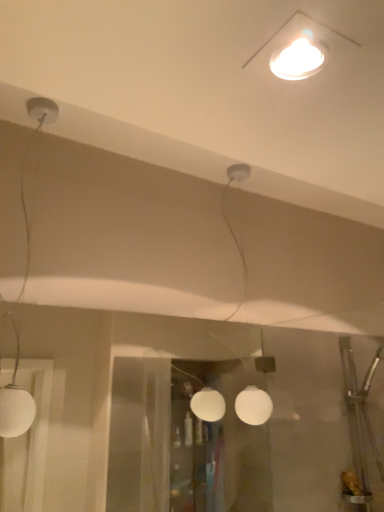
Question: Considering the relative positions of white matte globe at center, which is the 1th lamp from back to front, and white glossy light fixture at upper center, the 3th lamp viewed from the back, in the image provided, is white matte globe at center, which is the 1th lamp from back to front, to the left or to the right of white glossy light fixture at upper center, the 3th lamp viewed from the back,?

Choices:
 (A) right
 (B) left

Answer: (B)

Question: Considering the positions of white matte globe at center, which is the 1th lamp from back to front, and white glossy light fixture at upper center, the 1th lamp from the front, in the image, is white matte globe at center, which is the 1th lamp from back to front, bigger or smaller than white glossy light fixture at upper center, the 1th lamp from the front,?

Choices:
 (A) small
 (B) big

Answer: (B)

Question: Which is farther from the white matte globe at center, which is the 3th lamp from front to back?

Choices:
 (A) white matte globe lamp at left, which ranks as the 1th lamp in left-to-right order
 (B) white glossy light fixture at upper center, marked as the first lamp in a right-to-left arrangement

Answer: (A)

Question: Which object is the farthest from the white matte globe at center, which appears as the 2th lamp when viewed from the right?

Choices:
 (A) white matte globe lamp at left, which is counted as the second lamp, starting from the front
 (B) white glossy light fixture at upper center, the 3th lamp viewed from the back

Answer: (A)